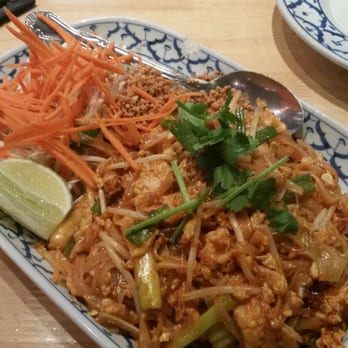
The width and height of the screenshot is (348, 348). Find the location of `white and blue china plate`. white and blue china plate is located at coordinates (343, 24).